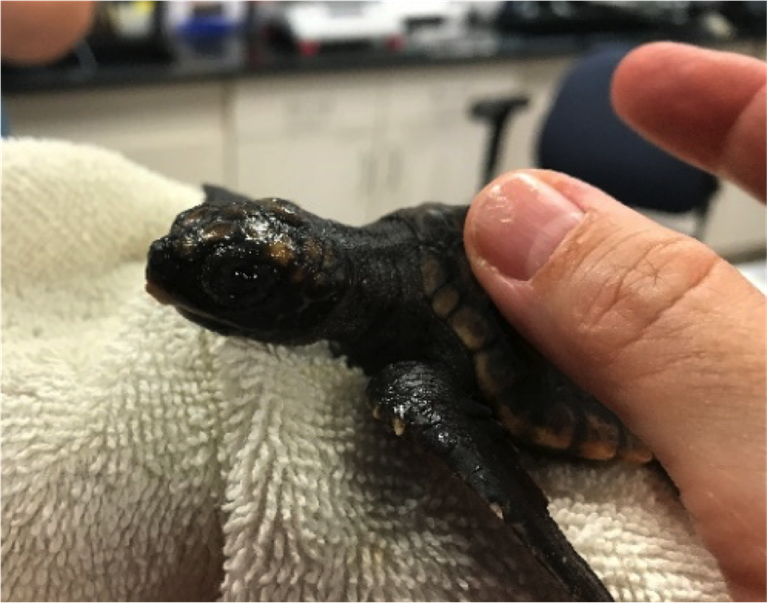
The image size is (768, 603). What are the coordinates of `chair` in the screenshot? It's located at (591, 151).